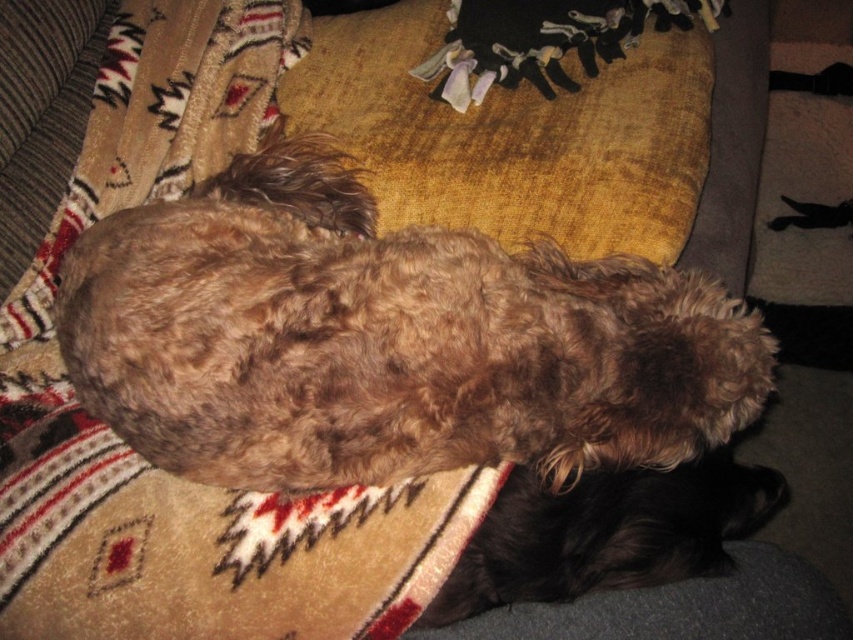
You are a photographer trying to capture the brown fuzzy dog at center and the brown fuzzy dog at lower right in a single shot. Based on their positions, which dog is closer to the camera?

The brown fuzzy dog at center is positioned over the brown fuzzy dog at lower right, so the brown fuzzy dog at center is closer to the camera.

You are a photographer setting up a shot of the brown fuzzy dog at center and the beige woven blanket at upper center. Which object will appear larger in your photo?

The brown fuzzy dog at center will appear larger in the photo because it is closer to the viewer than the beige woven blanket at upper center.

You are a photographer setting up a shot of the beige woven blanket at upper center and the brown fuzzy dog at lower right. To ensure both subjects are in focus, you need to know which one is taller. Can you determine which object is taller?

The beige woven blanket at upper center is taller than the brown fuzzy dog at lower right according to the description.